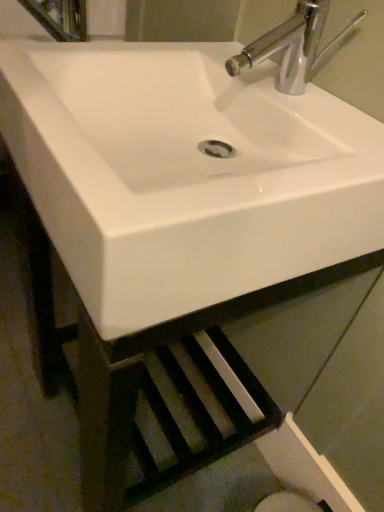
What do you see at coordinates (184, 175) in the screenshot?
I see `white glossy sink at center` at bounding box center [184, 175].

This screenshot has width=384, height=512. Find the location of `white glossy sink at center`. white glossy sink at center is located at coordinates (184, 175).

In order to click on white glossy sink at center in this screenshot , I will do `click(184, 175)`.